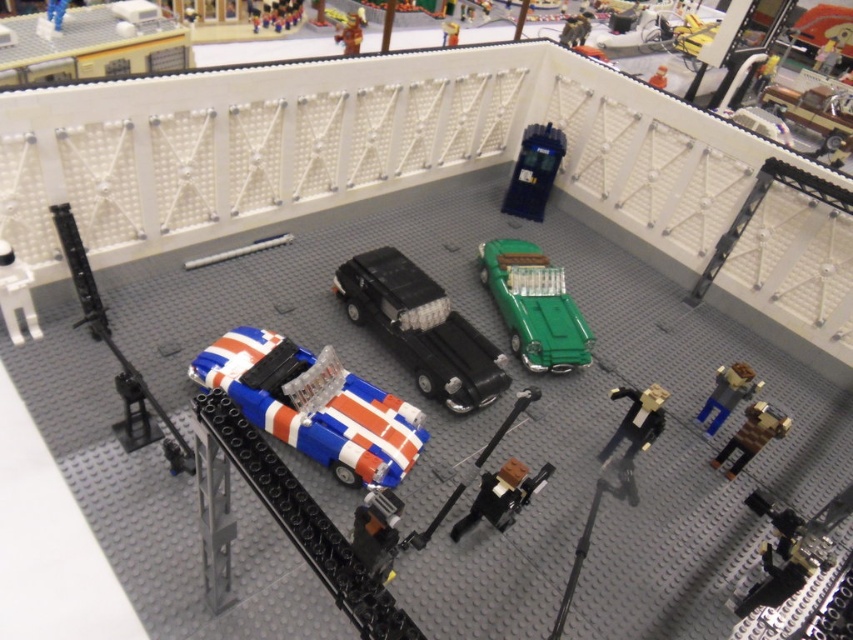
In the LEGO diorama, there is a brown matte figure at lower right and a smooth brown figurine at upper center. From the perspective of an observer looking at the image, which of these two figures is positioned more to the left?

The smooth brown figurine at upper center is positioned to the left of the brown matte figure at lower right.

You are standing at the point marked as point (746,419) in the LEGO diorama. You want to pick up a toy car that is 1.5 meters away from you. Is there a toy car within reach?

The point (746,419) is 2.22 meters away from the viewer. Since the toy car is 1.5 meters away from the point, the total distance from the viewer to the car would be 2.22 meters plus 1.5 meters, totaling 3.72 meters. Therefore, the toy car is out of reach for the viewer.